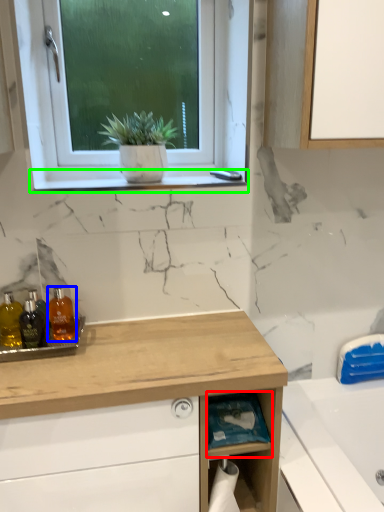
Question: Estimate the real-world distances between objects in this image. Which object is closer to shelf (highlighted by a red box), toiletry (highlighted by a blue box) or window sill (highlighted by a green box)?

Choices:
 (A) toiletry
 (B) window sill

Answer: (A)